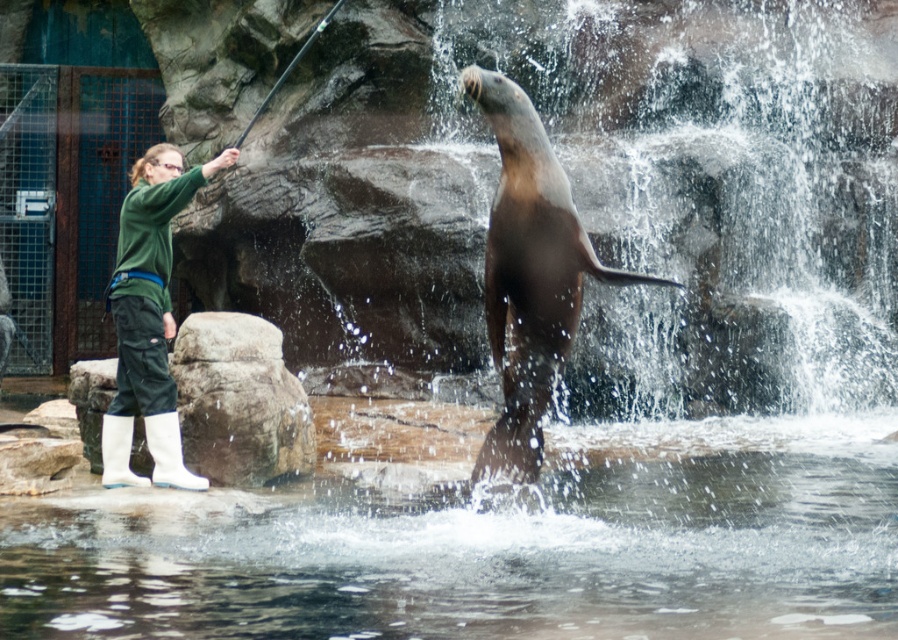
You are a zookeeper trying to secure the seal in the green fabric cage at left. However, you notice the seal is near the green fabric pants at left. Based on their sizes, will the seal fit into the cage?

The green fabric cage at left is smaller than the green fabric pants at left. Since the seal is near the green fabric pants at left, it may not fit into the smaller cage.

You are a zookeeper trying to reach the gray rock at center to place some food. You are currently standing on the clear water at lower center. Is there enough space between them for you to move safely?

The clear water at lower center has a larger width than the gray rock at center, so there is sufficient space for the zookeeper to move safely between them.